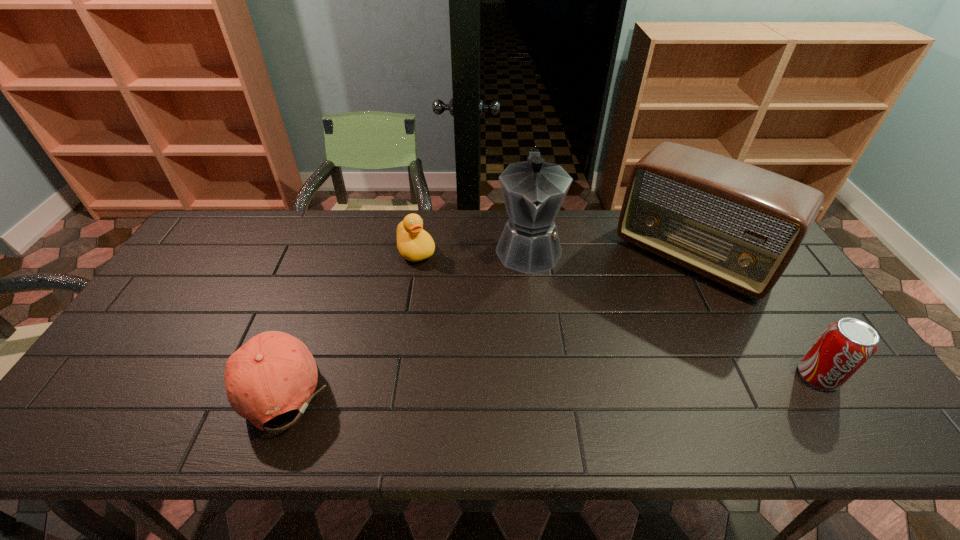
Image resolution: width=960 pixels, height=540 pixels. Identify the location of duck that is at the far edge. (414, 244).

Locate an element on the screen. This screenshot has height=540, width=960. baseball cap present at the near edge is located at coordinates (274, 372).

Find the location of a particular element. This screenshot has width=960, height=540. soda can that is positioned at the near edge is located at coordinates (842, 349).

Locate an element on the screen. soda can at the right edge is located at coordinates (842, 349).

Where is `radio receiver that is at the right edge`? This screenshot has width=960, height=540. radio receiver that is at the right edge is located at coordinates (740, 225).

Locate an element on the screen. The height and width of the screenshot is (540, 960). object that is at the far right corner is located at coordinates (740, 225).

You are a GUI agent. You are given a task and a screenshot of the screen. Output one action in this format:
    pyautogui.click(x=<x>, y=<y>)
    Task: Click on the object that is at the near right corner
    
    Given the screenshot: What is the action you would take?
    pyautogui.click(x=842, y=349)

Identify the location of vacant space at the far edge of the desktop. The image size is (960, 540). (480, 217).

At what (x,y) coordinates should I click in order to perform the action: click on free region at the near edge of the desktop. Please return your answer as a coordinate pair (x, y). The width and height of the screenshot is (960, 540). Looking at the image, I should click on (732, 389).

Image resolution: width=960 pixels, height=540 pixels. Identify the location of vacant area at the near left corner. (130, 375).